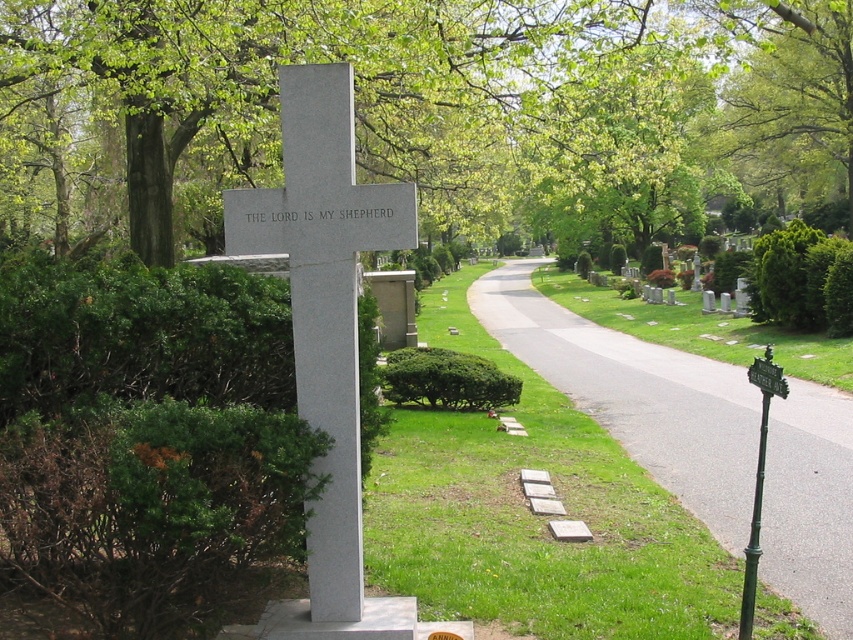
You are standing at the entrance of the cemetery and see the green leafy tree at upper left and the white polished stone cross at center. Which object is positioned higher in the image?

The green leafy tree at upper left is located above the white polished stone cross at center, so it is positioned higher in the image.

You are a gardener planning to place a new flower bed between the asphalt road at center and the white polished stone cross at center. Given their sizes, which object should you place the flower bed closer to in order to ensure it doesn

The asphalt road at center is wider than the white polished stone cross at center. Therefore, the flower bed should be placed closer to the white polished stone cross at center to maintain balance between the two objects.

You are a gardener who needs to mow the lawn near the asphalt road at center and the white polished stone cross at center. Which object should you avoid mowing over?

You should avoid mowing over the white polished stone cross at center because the asphalt road at center is positioned over it.